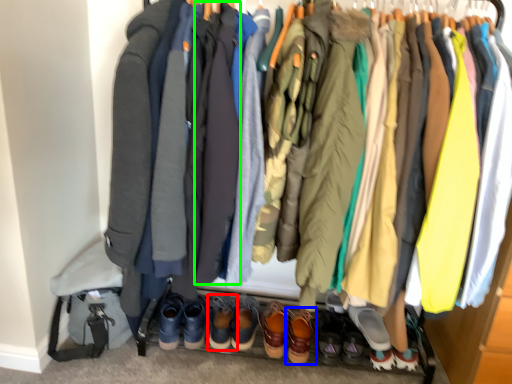
Question: Which object is the farthest from footwear (highlighted by a red box)? Choose among these: footwear (highlighted by a blue box) or robe (highlighted by a green box).

Choices:
 (A) footwear
 (B) robe

Answer: (B)